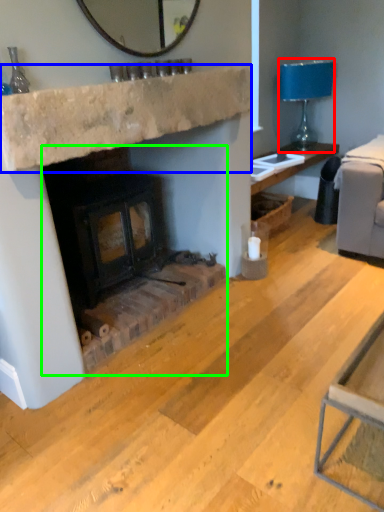
Question: Estimate the real-world distances between objects in this image. Which object is farther from lamp (highlighted by a red box), counter top (highlighted by a blue box) or wood burning stove (highlighted by a green box)?

Choices:
 (A) counter top
 (B) wood burning stove

Answer: (B)